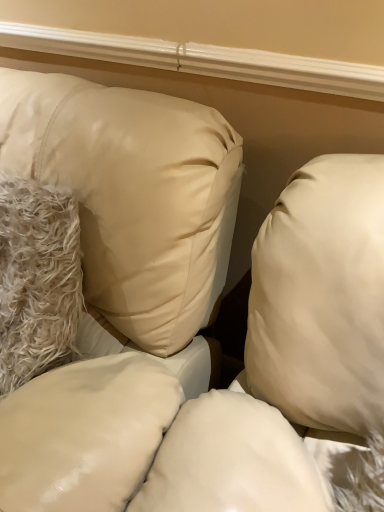
This screenshot has height=512, width=384. Describe the element at coordinates (37, 280) in the screenshot. I see `white fluffy pillow at left, which appears as the 2th pillow when viewed from the left` at that location.

This screenshot has width=384, height=512. In order to click on white fluffy pillow at left, which ranks as the first pillow in right-to-left order in this screenshot , I will do `click(37, 280)`.

In order to face white fluffy pillow at left, which ranks as the first pillow in right-to-left order, should I rotate leftwards or rightwards?

A 25.020 degree turn to the left will do.

What is the approximate width of white fluffy pillow at left, which ranks as the first pillow in right-to-left order?

white fluffy pillow at left, which ranks as the first pillow in right-to-left order, is 22.77 centimeters in width.

Find the location of a particular element. The width and height of the screenshot is (384, 512). beige satin pillow at upper left, acting as the second pillow starting from the right is located at coordinates (133, 195).

The width and height of the screenshot is (384, 512). What do you see at coordinates (133, 195) in the screenshot? I see `beige satin pillow at upper left, the first pillow from the left` at bounding box center [133, 195].

Find the location of a particular element. white fluffy pillow at left, which appears as the 2th pillow when viewed from the left is located at coordinates (37, 280).

Is beige satin pillow at upper left, acting as the second pillow starting from the right, at the right side of white fluffy pillow at left, which appears as the 2th pillow when viewed from the left?

No.

Who is more distant, beige satin pillow at upper left, the first pillow from the left, or white fluffy pillow at left, which ranks as the first pillow in right-to-left order?

white fluffy pillow at left, which ranks as the first pillow in right-to-left order, is further from the camera.

Does point (187, 342) appear closer or farther from the camera than point (76, 208)?

Point (187, 342) is farther from the camera than point (76, 208).

From the image's perspective, between beige satin pillow at upper left, acting as the second pillow starting from the right, and white fluffy pillow at left, which ranks as the first pillow in right-to-left order, which one is located above?

white fluffy pillow at left, which ranks as the first pillow in right-to-left order.

From a real-world perspective, is beige satin pillow at upper left, acting as the second pillow starting from the right, positioned under white fluffy pillow at left, which appears as the 2th pillow when viewed from the left, based on gravity?

Yes.

Which object is thinner, beige satin pillow at upper left, the first pillow from the left, or white fluffy pillow at left, which ranks as the first pillow in right-to-left order?

white fluffy pillow at left, which ranks as the first pillow in right-to-left order, is thinner.

Considering the relative sizes of beige satin pillow at upper left, the first pillow from the left, and white fluffy pillow at left, which ranks as the first pillow in right-to-left order, in the image provided, is beige satin pillow at upper left, the first pillow from the left, taller than white fluffy pillow at left, which ranks as the first pillow in right-to-left order,?

Indeed, beige satin pillow at upper left, the first pillow from the left, has a greater height compared to white fluffy pillow at left, which ranks as the first pillow in right-to-left order.

Can you confirm if beige satin pillow at upper left, the first pillow from the left, is smaller than white fluffy pillow at left, which ranks as the first pillow in right-to-left order?

No.

Is white fluffy pillow at left, which ranks as the first pillow in right-to-left order, surrounded by beige satin pillow at upper left, the first pillow from the left?

Yes, white fluffy pillow at left, which ranks as the first pillow in right-to-left order, is a part of beige satin pillow at upper left, the first pillow from the left.

Are beige satin pillow at upper left, acting as the second pillow starting from the right, and white fluffy pillow at left, which ranks as the first pillow in right-to-left order, making contact?

beige satin pillow at upper left, acting as the second pillow starting from the right, is not next to white fluffy pillow at left, which ranks as the first pillow in right-to-left order, and they're not touching.

Is beige satin pillow at upper left, the first pillow from the left, looking in the opposite direction of white fluffy pillow at left, which ranks as the first pillow in right-to-left order?

Yes, beige satin pillow at upper left, the first pillow from the left, is facing away from white fluffy pillow at left, which ranks as the first pillow in right-to-left order.

How far apart are beige satin pillow at upper left, acting as the second pillow starting from the right, and white fluffy pillow at left, which appears as the 2th pillow when viewed from the left?

beige satin pillow at upper left, acting as the second pillow starting from the right, is 13.71 centimeters from white fluffy pillow at left, which appears as the 2th pillow when viewed from the left.

Locate an element on the screen. The height and width of the screenshot is (512, 384). pillow located behind the beige satin pillow at upper left, the first pillow from the left is located at coordinates (37, 280).

Which object is positioned more to the left, white fluffy pillow at left, which appears as the 2th pillow when viewed from the left, or beige satin pillow at upper left, acting as the second pillow starting from the right?

beige satin pillow at upper left, acting as the second pillow starting from the right, is more to the left.

Relative to beige satin pillow at upper left, the first pillow from the left, is white fluffy pillow at left, which appears as the 2th pillow when viewed from the left, in front or behind?

Clearly, white fluffy pillow at left, which appears as the 2th pillow when viewed from the left, is behind beige satin pillow at upper left, the first pillow from the left.

Between point (18, 204) and point (95, 142), which one is positioned in front?

Positioned in front is point (95, 142).

From the image's perspective, relative to beige satin pillow at upper left, acting as the second pillow starting from the right, is white fluffy pillow at left, which appears as the 2th pillow when viewed from the left, above or below?

From the image's perspective, white fluffy pillow at left, which appears as the 2th pillow when viewed from the left, appears above beige satin pillow at upper left, acting as the second pillow starting from the right.

From a real-world perspective, is white fluffy pillow at left, which ranks as the first pillow in right-to-left order, positioned over beige satin pillow at upper left, acting as the second pillow starting from the right, based on gravity?

Correct, in the physical world, white fluffy pillow at left, which ranks as the first pillow in right-to-left order, is higher than beige satin pillow at upper left, acting as the second pillow starting from the right.

Can you confirm if white fluffy pillow at left, which ranks as the first pillow in right-to-left order, is wider than beige satin pillow at upper left, the first pillow from the left?

Incorrect, the width of white fluffy pillow at left, which ranks as the first pillow in right-to-left order, does not surpass that of beige satin pillow at upper left, the first pillow from the left.

In terms of height, does white fluffy pillow at left, which appears as the 2th pillow when viewed from the left, look taller or shorter compared to beige satin pillow at upper left, the first pillow from the left?

Considering their sizes, white fluffy pillow at left, which appears as the 2th pillow when viewed from the left, has less height than beige satin pillow at upper left, the first pillow from the left.

Between white fluffy pillow at left, which ranks as the first pillow in right-to-left order, and beige satin pillow at upper left, acting as the second pillow starting from the right, which one has smaller size?

white fluffy pillow at left, which ranks as the first pillow in right-to-left order.

Is white fluffy pillow at left, which appears as the 2th pillow when viewed from the left, positioned beyond the bounds of beige satin pillow at upper left, the first pillow from the left?

No.

Is white fluffy pillow at left, which ranks as the first pillow in right-to-left order, with beige satin pillow at upper left, the first pillow from the left?

No.

Is beige satin pillow at upper left, the first pillow from the left, at the back of white fluffy pillow at left, which appears as the 2th pillow when viewed from the left?

Yes, beige satin pillow at upper left, the first pillow from the left, is at the back of white fluffy pillow at left, which appears as the 2th pillow when viewed from the left.

Consider the image. How different are the orientations of white fluffy pillow at left, which appears as the 2th pillow when viewed from the left, and beige satin pillow at upper left, acting as the second pillow starting from the right, in degrees?

There is a 2.78-degree angle between the facing directions of white fluffy pillow at left, which appears as the 2th pillow when viewed from the left, and beige satin pillow at upper left, acting as the second pillow starting from the right.

Could you measure the distance between white fluffy pillow at left, which ranks as the first pillow in right-to-left order, and beige satin pillow at upper left, the first pillow from the left?

white fluffy pillow at left, which ranks as the first pillow in right-to-left order, is 13.71 centimeters from beige satin pillow at upper left, the first pillow from the left.

This screenshot has width=384, height=512. In order to click on pillow that appears behind the beige satin pillow at upper left, the first pillow from the left in this screenshot , I will do `click(37, 280)`.

I want to click on pillow behind the beige satin pillow at upper left, acting as the second pillow starting from the right, so click(x=37, y=280).

The width and height of the screenshot is (384, 512). What are the coordinates of `pillow that appears above the beige satin pillow at upper left, acting as the second pillow starting from the right (from a real-world perspective)` in the screenshot? It's located at (37, 280).